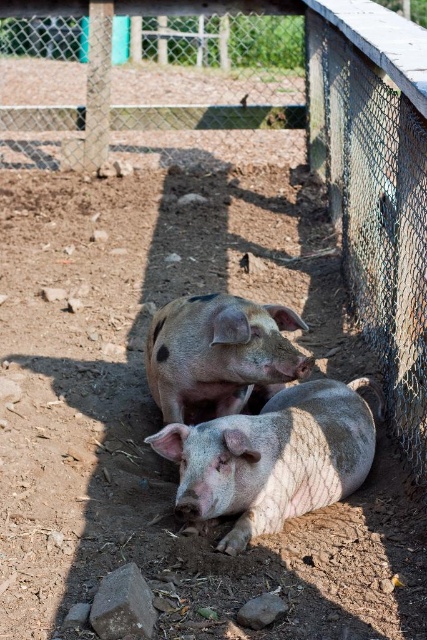
Can you confirm if metal mesh fence at upper center is wider than speckled pink pig at center?

Indeed, metal mesh fence at upper center has a greater width compared to speckled pink pig at center.

Describe the element at coordinates (151, 81) in the screenshot. I see `metal mesh fence at upper center` at that location.

The image size is (427, 640). What are the coordinates of `metal mesh fence at upper center` in the screenshot? It's located at (151, 81).

Can you confirm if metal mesh fence at upper center is shorter than pink matte pig at center?

No, metal mesh fence at upper center is not shorter than pink matte pig at center.

Can you confirm if metal mesh fence at upper center is bigger than pink matte pig at center?

Correct, metal mesh fence at upper center is larger in size than pink matte pig at center.

Where is `metal mesh fence at upper center`? Image resolution: width=427 pixels, height=640 pixels. metal mesh fence at upper center is located at coordinates (151, 81).

I want to click on metal mesh fence at upper center, so click(x=151, y=81).

How far apart are speckled pink pig at center and pink matte pig at center?

They are 14.31 inches apart.

Which is in front, point (259, 476) or point (222, 397)?

Point (259, 476) is in front.

Measure the distance between point (274, 419) and camera.

Point (274, 419) and camera are 2.79 meters apart from each other.

This screenshot has height=640, width=427. In order to click on speckled pink pig at center in this screenshot , I will do `click(274, 458)`.